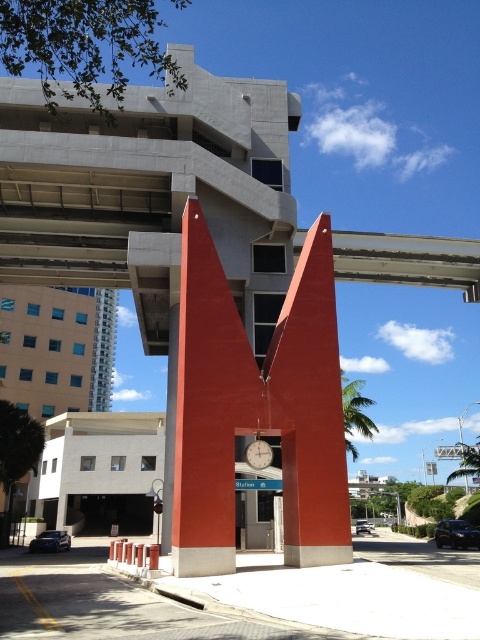
Question: Does smooth red pillar at center have a greater width compared to metallic silver clock at center?

Choices:
 (A) no
 (B) yes

Answer: (B)

Question: Can you confirm if smooth orange pillar at center is bigger than metallic silver clock at center?

Choices:
 (A) no
 (B) yes

Answer: (B)

Question: Considering the real-world distances, which object is farthest from the metallic silver clock at center?

Choices:
 (A) smooth orange pillar at center
 (B) smooth red pillar at center

Answer: (B)

Question: Can you confirm if smooth orange pillar at center is bigger than metallic silver clock at center?

Choices:
 (A) no
 (B) yes

Answer: (B)

Question: Which object is positioned farthest from the smooth red pillar at center?

Choices:
 (A) metallic silver clock at center
 (B) smooth orange pillar at center

Answer: (A)

Question: Which point is closer to the camera taking this photo?

Choices:
 (A) (260, 445)
 (B) (315, 410)

Answer: (B)